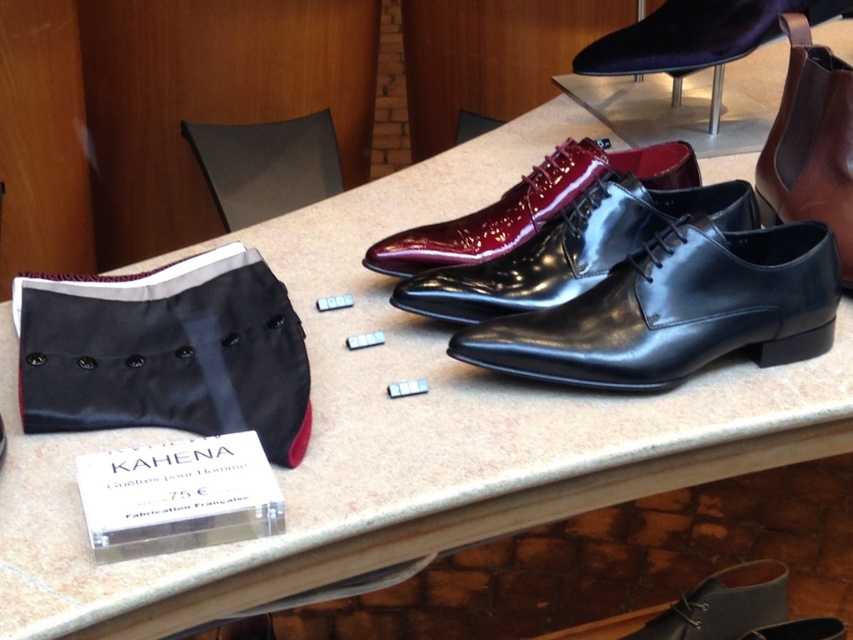
Question: Among these points, which one is nearest to the camera?

Choices:
 (A) (817, 108)
 (B) (639, 68)
 (C) (403, 241)

Answer: (C)

Question: Considering the relative positions of black leather shoes at center and velvet dark blue shoe at upper center in the image provided, where is black leather shoes at center located with respect to velvet dark blue shoe at upper center?

Choices:
 (A) left
 (B) right

Answer: (A)

Question: Which object is the closest to the glossy patent leather dress shoe at center?

Choices:
 (A) shiny black leather shoes at center
 (B) brown leather boot at upper right
 (C) black leather shoes at center

Answer: (A)

Question: Which object is farther from the camera taking this photo?

Choices:
 (A) glossy patent leather dress shoe at center
 (B) brown leather boot at upper right

Answer: (A)

Question: Is shiny black leather shoes at center below brown leather boot at upper right?

Choices:
 (A) yes
 (B) no

Answer: (A)

Question: Can you confirm if black leather shoes at center is thinner than velvet dark blue shoe at upper center?

Choices:
 (A) no
 (B) yes

Answer: (B)